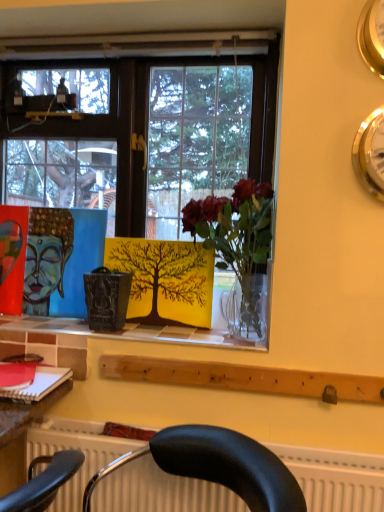
The height and width of the screenshot is (512, 384). I want to click on white textured radiator at lower center, so click(x=336, y=478).

What do you see at coordinates (336, 478) in the screenshot?
I see `white textured radiator at lower center` at bounding box center [336, 478].

Locate an element on the screen. The image size is (384, 512). matte blue painting at center is located at coordinates (46, 257).

What do you see at coordinates (372, 35) in the screenshot?
I see `gold metallic clock at upper right, which ranks as the first clock in top-to-bottom order` at bounding box center [372, 35].

Measure the distance between gold metallic clock at upper right, which ranks as the first clock in top-to-bottom order, and camera.

1.12 meters.

The height and width of the screenshot is (512, 384). Describe the element at coordinates (106, 333) in the screenshot. I see `white tile at center` at that location.

Locate an element on the screen. The width and height of the screenshot is (384, 512). white textured radiator at lower center is located at coordinates point(336,478).

Is translucent glass vase at center not near matte red book at lower left?

No, translucent glass vase at center is not far from matte red book at lower left.

Find the location of a particular element. This screenshot has height=512, width=384. houseplant on the right of matte red book at lower left is located at coordinates (236, 237).

Is translucent glass vase at center facing towards matte red book at lower left?

No, translucent glass vase at center is not aimed at matte red book at lower left.

Between matte blue painting at center and gold metallic clock at upper right, marked as the 2th clock in a top-to-bottom arrangement, which one has more height?

matte blue painting at center is taller.

Does point (56, 232) come behind point (356, 149)?

Yes.

Which clock is the 1st one when counting from the right side of the matte blue painting at center? Please provide its 2D coordinates.

[(370, 154)]

Which of these two, gold metallic clock at upper right, marked as the 2th clock in a top-to-bottom arrangement, or gold metallic clock at upper right, which appears as the second clock when ordered from the bottom, stands taller?

gold metallic clock at upper right, marked as the 2th clock in a top-to-bottom arrangement.

Between gold metallic clock at upper right, marked as the 2th clock in a top-to-bottom arrangement, and gold metallic clock at upper right, which appears as the second clock when ordered from the bottom, which one is positioned in front?

gold metallic clock at upper right, which appears as the second clock when ordered from the bottom, is closer to the camera.

Considering the sizes of objects gold metallic clock at upper right, marked as the 2th clock in a top-to-bottom arrangement, and gold metallic clock at upper right, which ranks as the first clock in top-to-bottom order, in the image provided, who is thinner, gold metallic clock at upper right, marked as the 2th clock in a top-to-bottom arrangement, or gold metallic clock at upper right, which ranks as the first clock in top-to-bottom order,?

Thinner between the two is gold metallic clock at upper right, which ranks as the first clock in top-to-bottom order.

Is gold metallic clock at upper right, marked as the 2th clock in a top-to-bottom arrangement, smaller than gold metallic clock at upper right, which ranks as the first clock in top-to-bottom order?

No, gold metallic clock at upper right, marked as the 2th clock in a top-to-bottom arrangement, is not smaller than gold metallic clock at upper right, which ranks as the first clock in top-to-bottom order.

Considering the sizes of objects yellow matte tree at center and white textured radiator at lower center in the image provided, who is thinner, yellow matte tree at center or white textured radiator at lower center?

yellow matte tree at center is thinner.

In the image, is yellow matte tree at center on the left side or the right side of white textured radiator at lower center?

Clearly, yellow matte tree at center is on the left of white textured radiator at lower center in the image.

Find the location of a particular element. radiator lying in front of the yellow matte tree at center is located at coordinates (336, 478).

From the image's perspective, between yellow matte tree at center and white textured radiator at lower center, who is located below?

white textured radiator at lower center.

Can white tile at center be found inside yellow matte tree at center?

No, white tile at center is not inside yellow matte tree at center.

Does yellow matte tree at center touch white tile at center?

yellow matte tree at center is not next to white tile at center, and they're not touching.

Which object is thinner, yellow matte tree at center or white tile at center?

With smaller width is yellow matte tree at center.

Considering the relative positions of yellow matte tree at center and white tile at center in the image provided, is yellow matte tree at center to the right of white tile at center from the viewer's perspective?

Correct, you'll find yellow matte tree at center to the right of white tile at center.

Is matte red book at lower left oriented towards translucent glass vase at center?

No, matte red book at lower left is not facing towards translucent glass vase at center.

Can you confirm if matte red book at lower left is taller than translucent glass vase at center?

No, matte red book at lower left is not taller than translucent glass vase at center.

Does point (13, 394) appear closer or farther from the camera than point (240, 193)?

Point (13, 394).

How distant is matte red book at lower left from translucent glass vase at center?

matte red book at lower left and translucent glass vase at center are 26.39 inches apart from each other.

Is white textured radiator at lower center further to the viewer compared to translucent glass vase at center?

No.

How many degrees apart are the facing directions of white textured radiator at lower center and translucent glass vase at center?

There is a 3.36-degree angle between the facing directions of white textured radiator at lower center and translucent glass vase at center.

Which of these two, white textured radiator at lower center or translucent glass vase at center, is bigger?

With larger size is white textured radiator at lower center.

Considering the relative positions of white textured radiator at lower center and translucent glass vase at center in the image provided, is white textured radiator at lower center to the left or to the right of translucent glass vase at center?

Clearly, white textured radiator at lower center is on the left of translucent glass vase at center in the image.

Locate an element on the screen. The width and height of the screenshot is (384, 512). book on the left side of translucent glass vase at center is located at coordinates (40, 384).

Where is `person below the gold metallic clock at upper right, the 1th clock when ordered from bottom to top (from a real-world perspective)`? Image resolution: width=384 pixels, height=512 pixels. person below the gold metallic clock at upper right, the 1th clock when ordered from bottom to top (from a real-world perspective) is located at coordinates (46, 257).

Estimate the real-world distances between objects in this image. Which object is closer to gold metallic clock at upper right, the 1th clock when ordered from bottom to top, white tile at center or matte blue painting at center?

Based on the image, white tile at center appears to be nearer to gold metallic clock at upper right, the 1th clock when ordered from bottom to top.

From the image, which object appears to be farther from translucent glass vase at center, matte red book at lower left or yellow matte tree at center?

Based on the image, matte red book at lower left appears to be further to translucent glass vase at center.

Looking at the image, which one is located further to gold metallic clock at upper right, the 1th clock when ordered from bottom to top, white textured radiator at lower center or matte red book at lower left?

matte red book at lower left lies further to gold metallic clock at upper right, the 1th clock when ordered from bottom to top, than the other object.

Which object lies nearer to the anchor point translucent glass vase at center, white tile at center or gold metallic clock at upper right, which appears as the second clock when ordered from the bottom?

The object closer to translucent glass vase at center is white tile at center.

Estimate the real-world distances between objects in this image. Which object is closer to white tile at center, gold metallic clock at upper right, which appears as the second clock when ordered from the bottom, or matte red book at lower left?

matte red book at lower left is closer to white tile at center.

From the image, which object appears to be farther from yellow matte tree at center, white textured radiator at lower center or matte blue painting at center?

white textured radiator at lower center.

Based on their spatial positions, is white textured radiator at lower center or gold metallic clock at upper right, which ranks as the first clock in top-to-bottom order, further from matte blue painting at center?

The object further to matte blue painting at center is gold metallic clock at upper right, which ranks as the first clock in top-to-bottom order.

Based on their spatial positions, is yellow matte tree at center or matte blue painting at center further from translucent glass vase at center?

Based on the image, matte blue painting at center appears to be further to translucent glass vase at center.

This screenshot has height=512, width=384. Find the location of `person situated between matte red book at lower left and yellow matte tree at center from left to right`. person situated between matte red book at lower left and yellow matte tree at center from left to right is located at coordinates (46, 257).

The image size is (384, 512). I want to click on person located between matte red book at lower left and translucent glass vase at center in the left-right direction, so click(46, 257).

This screenshot has width=384, height=512. I want to click on plant situated between matte red book at lower left and translucent glass vase at center from left to right, so click(x=165, y=280).

Image resolution: width=384 pixels, height=512 pixels. I want to click on plant located between matte blue painting at center and gold metallic clock at upper right, marked as the 2th clock in a top-to-bottom arrangement, in the left-right direction, so click(165, 280).